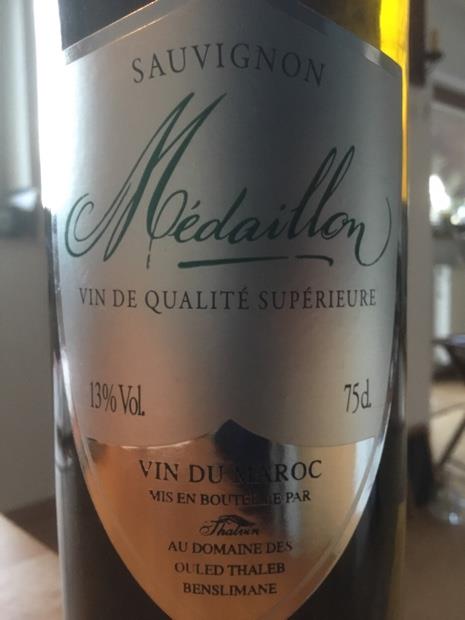
Where is `candle`? Image resolution: width=465 pixels, height=620 pixels. candle is located at coordinates click(433, 38).